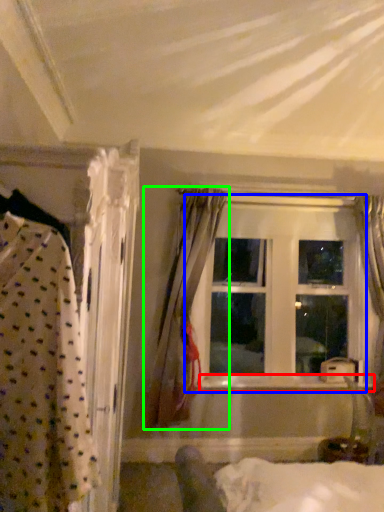
Question: Considering the real-world distances, which object is closest to window sill (highlighted by a red box)? window (highlighted by a blue box) or curtain (highlighted by a green box).

Choices:
 (A) window
 (B) curtain

Answer: (A)